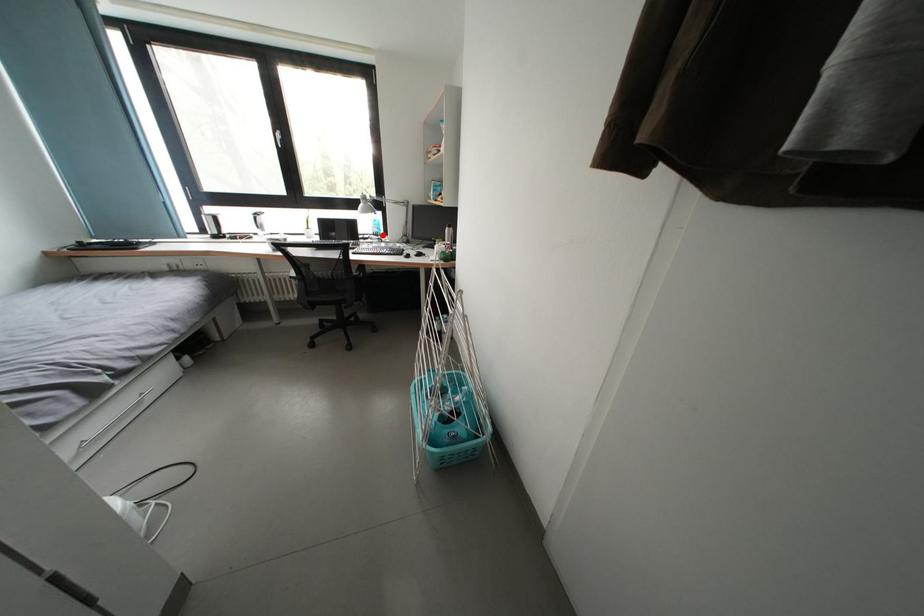
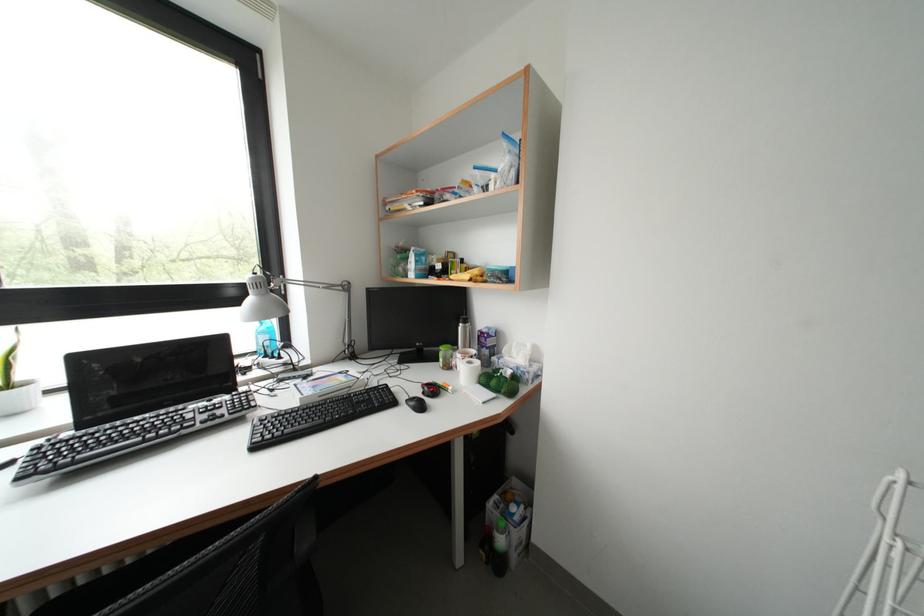
Question: I am providing you with two images of the same scene from different viewpoints. In image1, a red point is highlighted. Considering the same 3D point in image2, which of the following is correct?

Choices:
 (A) It is closer
 (B) It is farther

Answer: (B)